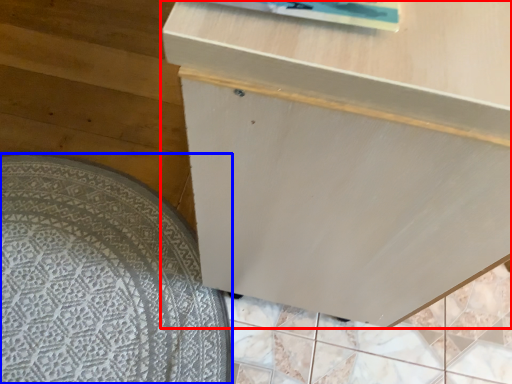
Question: Which of the following is the closest to the observer, furniture (highlighted by a red box) or mat (highlighted by a blue box)?

Choices:
 (A) furniture
 (B) mat

Answer: (A)